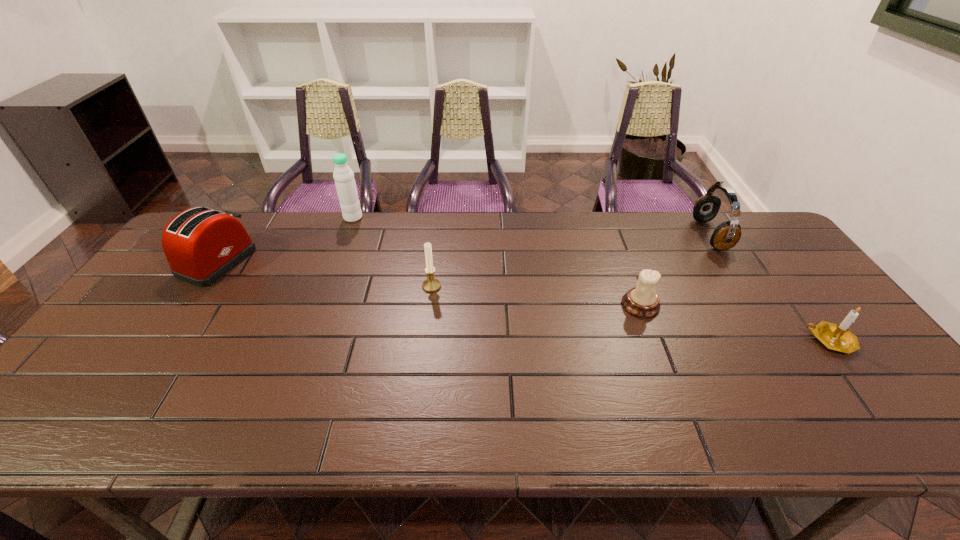
Find the location of a particular element. free space between the toaster and the headset is located at coordinates (464, 248).

Identify the location of vacant space that's between the leftmost object and the third object from left to right. This screenshot has width=960, height=540. (324, 274).

Identify the location of vacant region between the leftmost object and the nearest candle holder. (524, 301).

Where is `vacant area that lies between the nearest candle holder and the second candle holder from left to right`? This screenshot has height=540, width=960. vacant area that lies between the nearest candle holder and the second candle holder from left to right is located at coordinates click(x=735, y=323).

Locate an element on the screen. free space between the leftmost candle holder and the second object from left to right is located at coordinates (393, 252).

Where is `free spot between the second object from right to left and the leftmost candle holder`? The image size is (960, 540). free spot between the second object from right to left and the leftmost candle holder is located at coordinates (571, 260).

The height and width of the screenshot is (540, 960). I want to click on object that ranks as the second closest to the leftmost object, so click(x=431, y=284).

Identify which object is located as the nearest to the leftmost candle holder. Please provide its 2D coordinates. Your answer should be formatted as a tuple, i.e. [(x, y)], where the tuple contains the x and y coordinates of a point satisfying the conditions above.

[(345, 183)]

Locate an element on the screen. The image size is (960, 540). candle holder that can be found as the closest to the leftmost object is located at coordinates (431, 284).

Locate an element on the screen. candle holder that is the third closest to the tallest object is located at coordinates (837, 337).